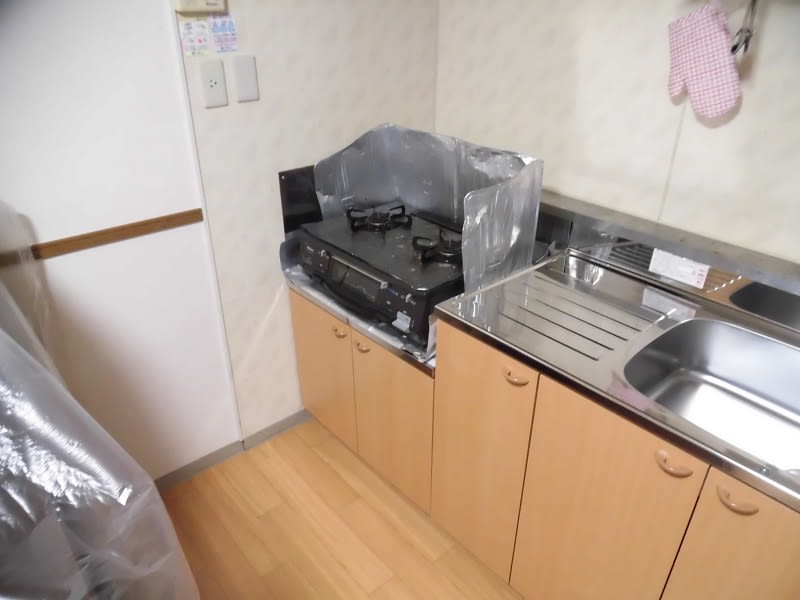
Where is `electrical outlet`? electrical outlet is located at coordinates (213, 92).